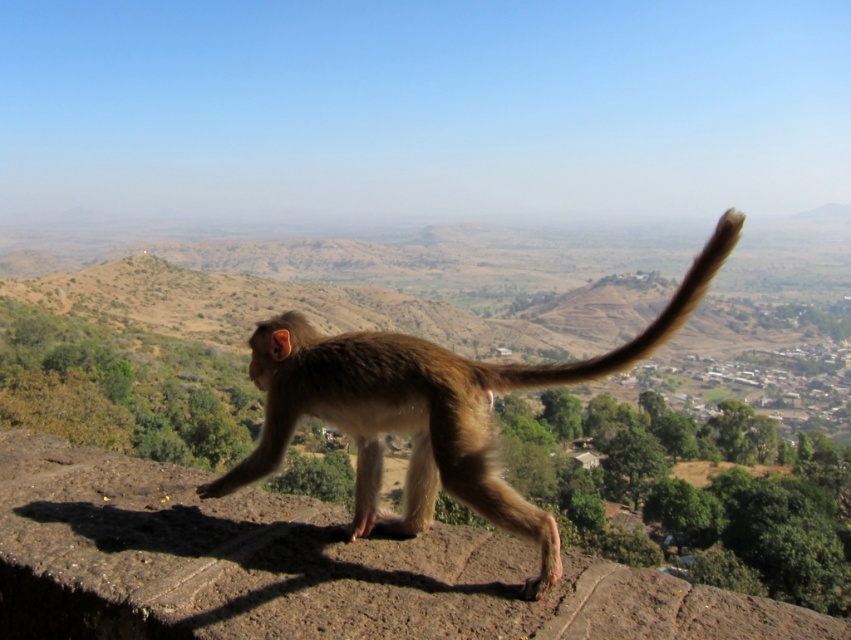
Can you confirm if brown furry monkey at center is positioned to the left of brown furry tail at center?

Correct, you'll find brown furry monkey at center to the left of brown furry tail at center.

Measure the distance from brown furry monkey at center to brown furry tail at center.

brown furry monkey at center is 4.15 feet away from brown furry tail at center.

Identify the location of brown furry monkey at center. Image resolution: width=851 pixels, height=640 pixels. (429, 410).